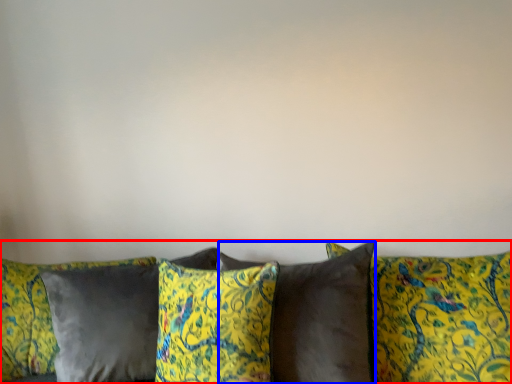
Question: Which object appears farthest to the camera in this image, studio couch (highlighted by a red box) or pillow (highlighted by a blue box)?

Choices:
 (A) studio couch
 (B) pillow

Answer: (B)